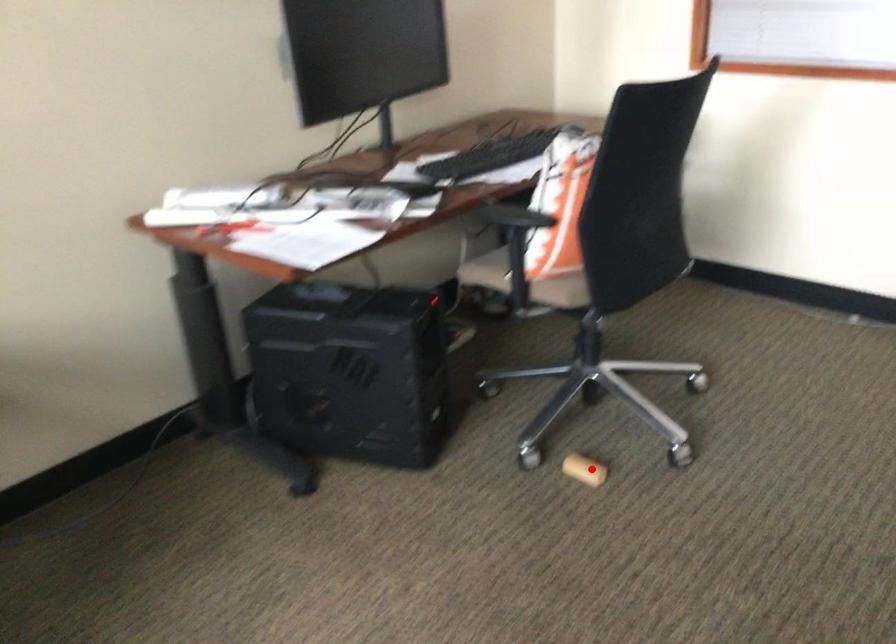
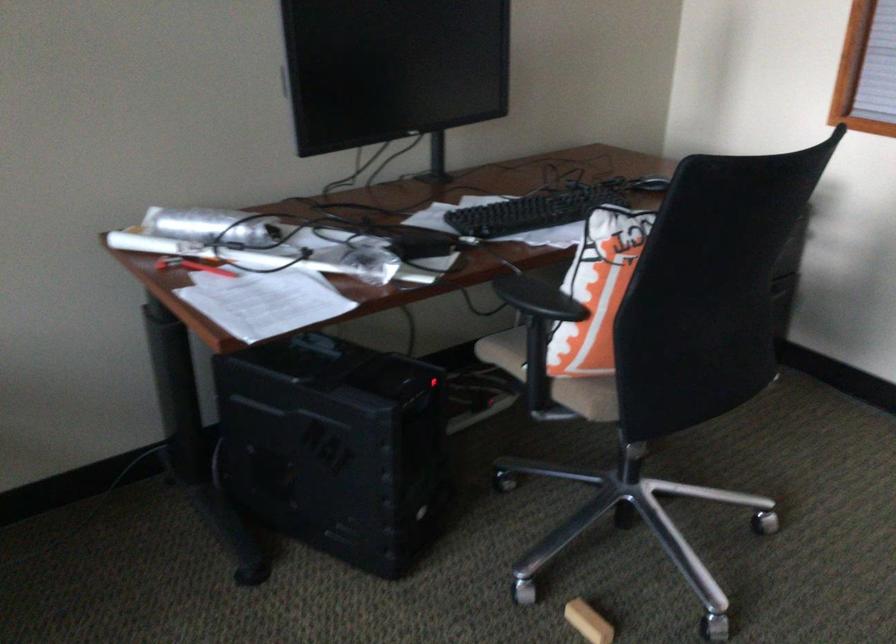
Find the pixel in the second image that matches the highlighted location in the first image.

(588, 621)